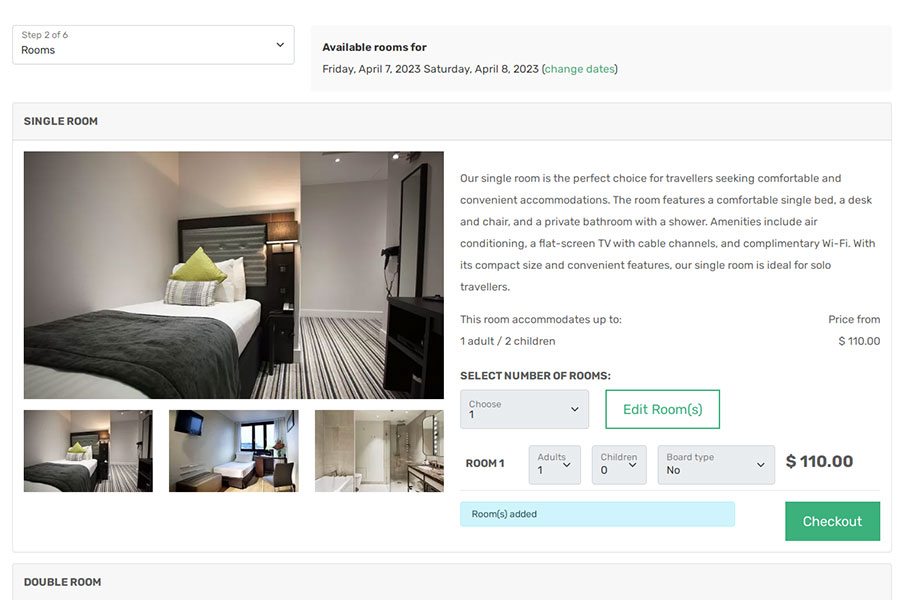
Find the location of `picture of room`. picture of room is located at coordinates (165, 303).